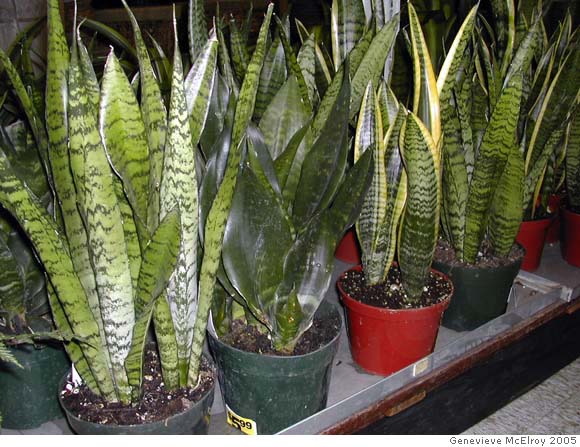
Find the location of a particular element. The width and height of the screenshot is (580, 447). planters (pots for planting) is located at coordinates (572, 237), (527, 239), (353, 249), (467, 286), (413, 326), (297, 388), (179, 419), (45, 370).